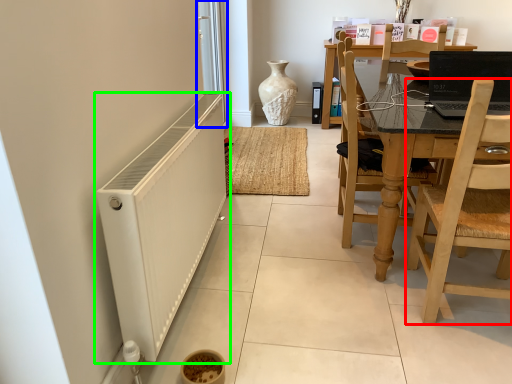
Question: Which object is the closest to the chair (highlighted by a red box)? Choose among these: screen door (highlighted by a blue box) or radiator (highlighted by a green box).

Choices:
 (A) screen door
 (B) radiator

Answer: (B)